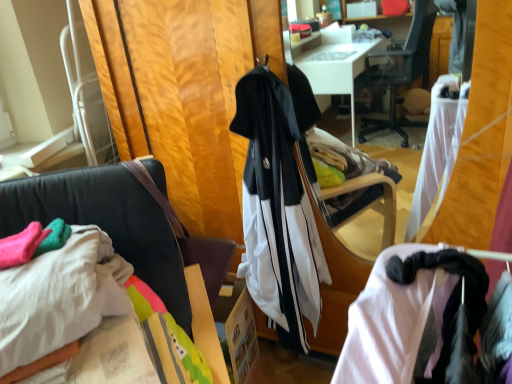
What do you see at coordinates (120, 228) in the screenshot?
I see `velvet black chair at center` at bounding box center [120, 228].

Identify the location of white matte tracksuit at center. (279, 205).

Could you tell me if velvet black chair at center is turned towards white cotton sheet at lower left?

Yes, velvet black chair at center is oriented towards white cotton sheet at lower left.

This screenshot has height=384, width=512. Find the location of `chair located underneath the white cotton sheet at lower left (from a real-world perspective)`. chair located underneath the white cotton sheet at lower left (from a real-world perspective) is located at coordinates (120, 228).

Are velvet black chair at center and white cotton sheet at lower left far apart?

velvet black chair at center is actually quite close to white cotton sheet at lower left.

Which is behind, velvet black chair at center or white matte tracksuit at center?

white matte tracksuit at center is more distant.

Would you consider velvet black chair at center to be distant from white matte tracksuit at center?

No, velvet black chair at center is not far from white matte tracksuit at center.

From a real-world perspective, who is located lower, velvet black chair at center or white matte tracksuit at center?

→ From a 3D spatial view, velvet black chair at center is below.

From the image's perspective, which is above, velvet black chair at center or white matte tracksuit at center?

white matte tracksuit at center.

Which of these two, white matte tracksuit at center or velvet black chair at center, is wider?

velvet black chair at center.

Based on the photo, considering the positions of objects white matte tracksuit at center and velvet black chair at center in the image provided, who is in front, white matte tracksuit at center or velvet black chair at center?

velvet black chair at center is closer to the camera.

Consider the image. Is white matte tracksuit at center with velvet black chair at center?

No, white matte tracksuit at center is not making contact with velvet black chair at center.

Which object is further away from the camera, white matte tracksuit at center or white cotton sheet at lower left?

white matte tracksuit at center.

Is white matte tracksuit at center oriented towards white cotton sheet at lower left?

No.

Considering the relative sizes of white matte tracksuit at center and white cotton sheet at lower left in the image provided, is white matte tracksuit at center taller than white cotton sheet at lower left?

Indeed, white matte tracksuit at center has a greater height compared to white cotton sheet at lower left.

Is point (265, 171) farther from viewer compared to point (89, 319)?

That is True.

Consider the image. From the image's perspective, which object appears higher, white cotton sheet at lower left or white matte tracksuit at center?

white matte tracksuit at center, from the image's perspective.

Consider the image. From a real-world perspective, is white cotton sheet at lower left below white matte tracksuit at center?

No, from a real-world perspective, white cotton sheet at lower left is not under white matte tracksuit at center.

From their relative heights in the image, would you say white cotton sheet at lower left is taller or shorter than white matte tracksuit at center?

Clearly, white cotton sheet at lower left is shorter compared to white matte tracksuit at center.

Is white cotton sheet at lower left facing away from white matte tracksuit at center?

No.

Does white cotton sheet at lower left appear on the right side of velvet black chair at center?

In fact, white cotton sheet at lower left is to the left of velvet black chair at center.

Is point (99, 313) more distant than point (20, 185)?

No.

From the image's perspective, is white cotton sheet at lower left located above velvet black chair at center?

Yes, from the image's perspective, white cotton sheet at lower left is over velvet black chair at center.

Identify the location of chair in front of the white cotton sheet at lower left. tap(120, 228).

Where is `garment on the right of the velvet black chair at center`? Image resolution: width=512 pixels, height=384 pixels. garment on the right of the velvet black chair at center is located at coordinates (279, 205).

Looking at the image, which one is located closer to white cotton sheet at lower left, white matte tracksuit at center or velvet black chair at center?

velvet black chair at center lies closer to white cotton sheet at lower left than the other object.

When comparing their distances from white matte tracksuit at center, does white cotton sheet at lower left or velvet black chair at center seem further?

Among the two, white cotton sheet at lower left is located further to white matte tracksuit at center.

Which object lies further to the anchor point white cotton sheet at lower left, velvet black chair at center or white matte tracksuit at center?

white matte tracksuit at center is positioned further to the anchor white cotton sheet at lower left.

Consider the image. Based on their spatial positions, is white matte tracksuit at center or white cotton sheet at lower left further from velvet black chair at center?

The object further to velvet black chair at center is white matte tracksuit at center.

Estimate the real-world distances between objects in this image. Which object is further from white matte tracksuit at center, velvet black chair at center or white cotton sheet at lower left?

white cotton sheet at lower left is further to white matte tracksuit at center.

Estimate the real-world distances between objects in this image. Which object is closer to velvet black chair at center, white cotton sheet at lower left or white matte tracksuit at center?

white cotton sheet at lower left is closer to velvet black chair at center.

You are a GUI agent. You are given a task and a screenshot of the screen. Output one action in this format:
    pyautogui.click(x=<x>, y=<y>)
    Task: Click on the sheet positioned between velvet black chair at center and white matte tracksuit at center from near to far
    
    Given the screenshot: What is the action you would take?
    pyautogui.click(x=60, y=296)